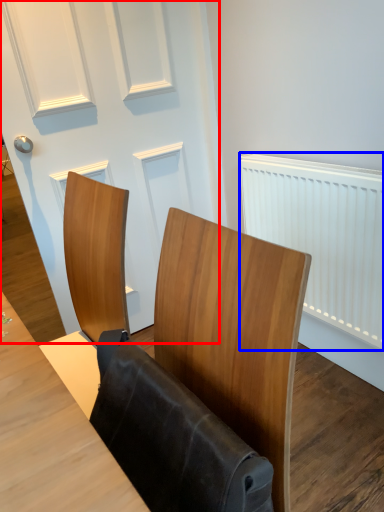
Question: Which point is further to the camera, door (highlighted by a red box) or radiator (highlighted by a blue box)?

Choices:
 (A) door
 (B) radiator

Answer: (A)